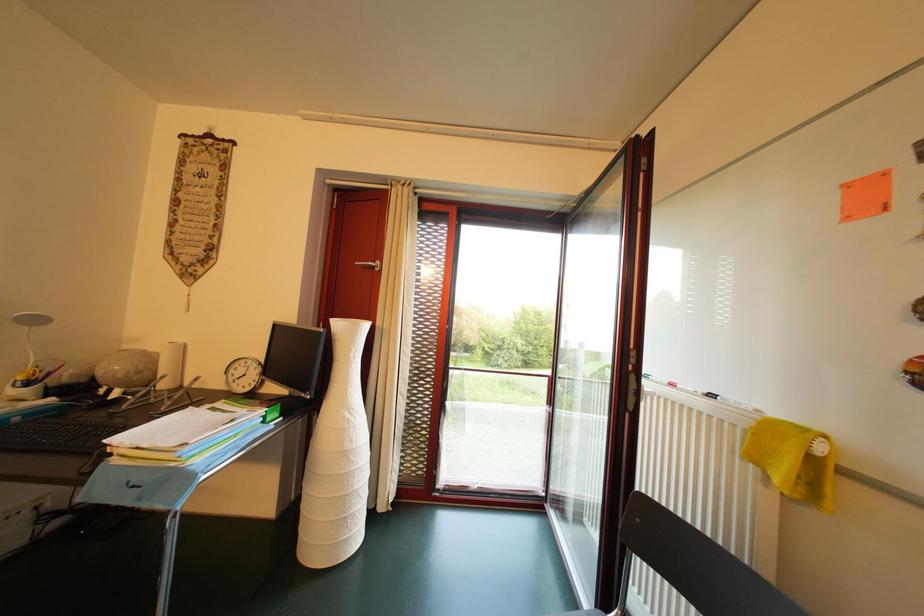
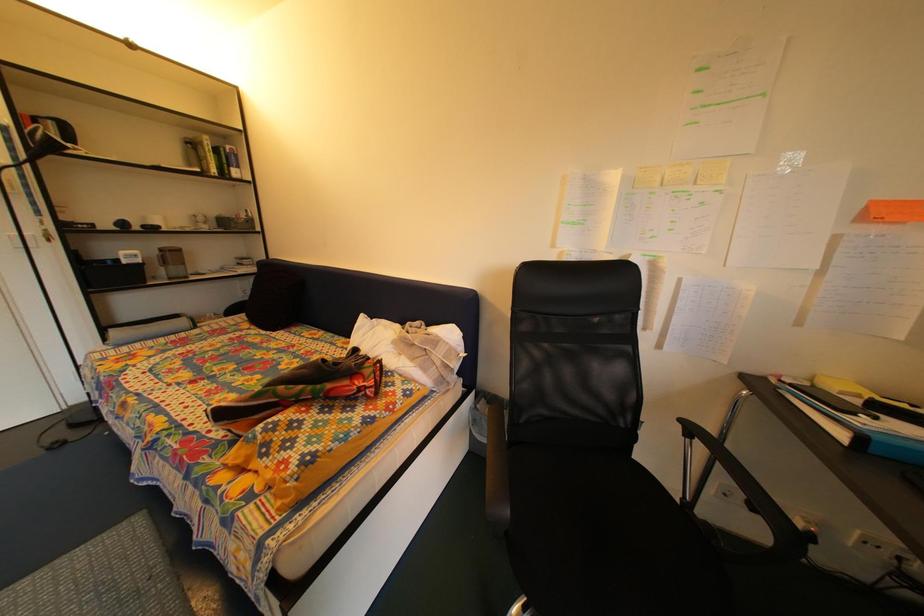
Question: The camera is either moving clockwise (left) or counter-clockwise (right) around the object. The first image is from the beginning of the video and the second image is from the end. Is the camera moving left or right when shooting the video?

Choices:
 (A) Left
 (B) Right

Answer: (B)